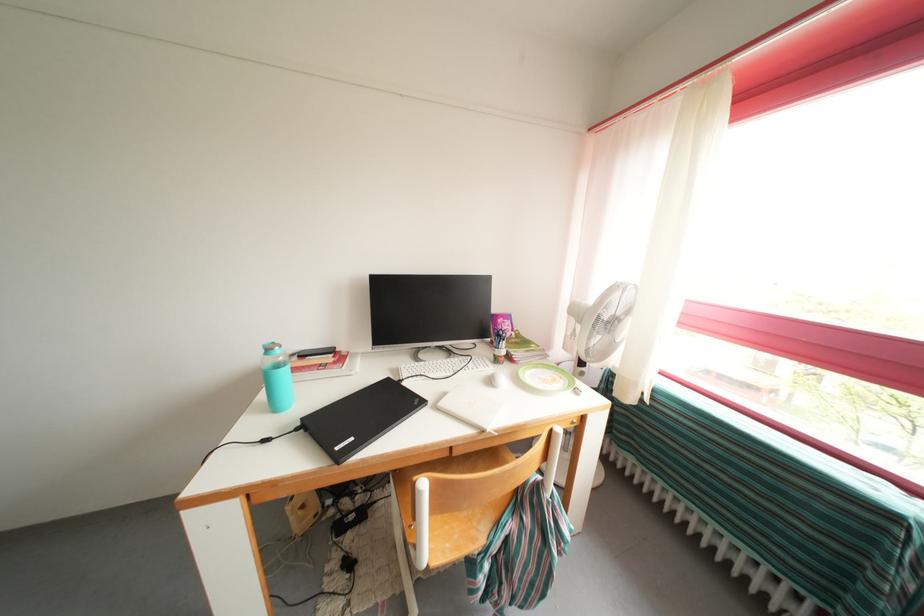
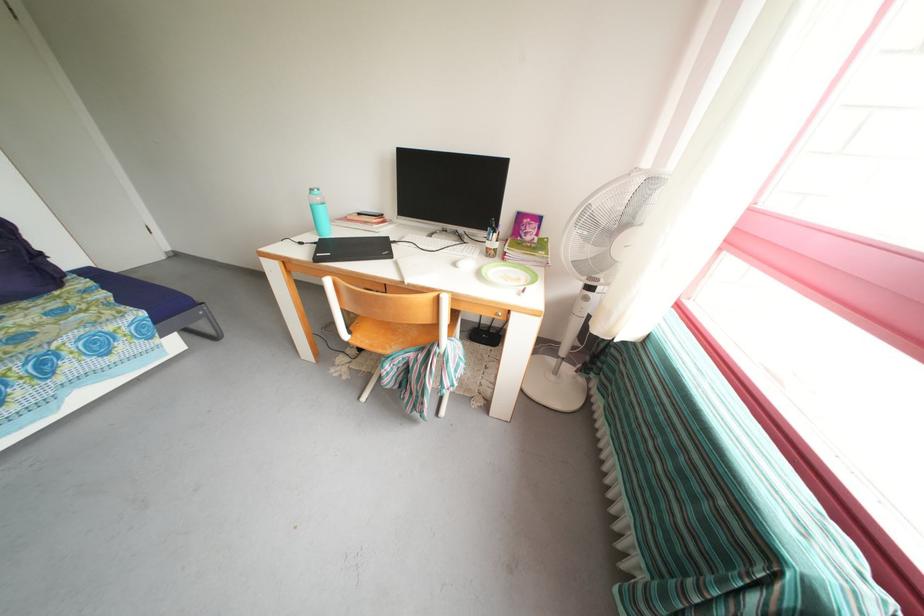
In the second image, find the point that corresponds to (x=275, y=355) in the first image.

(319, 196)